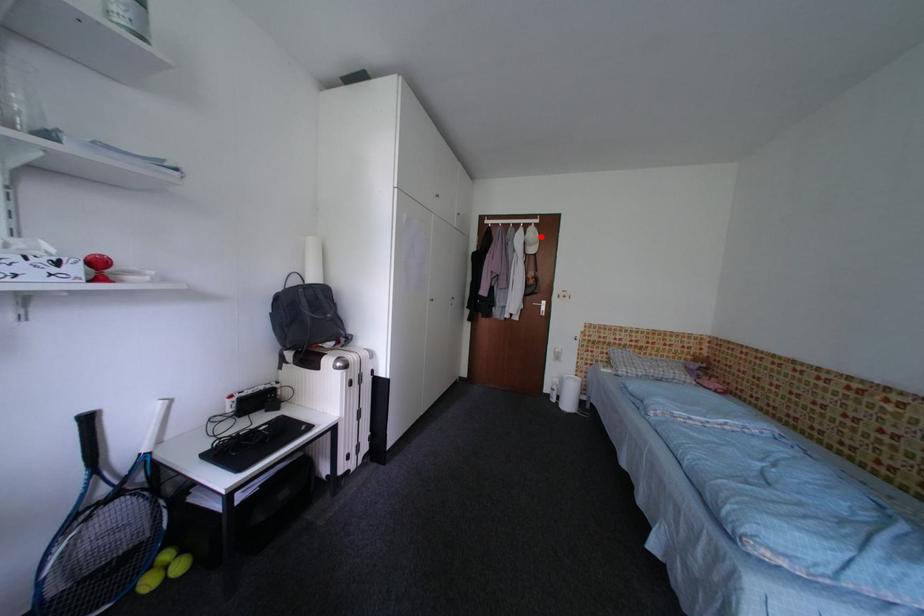
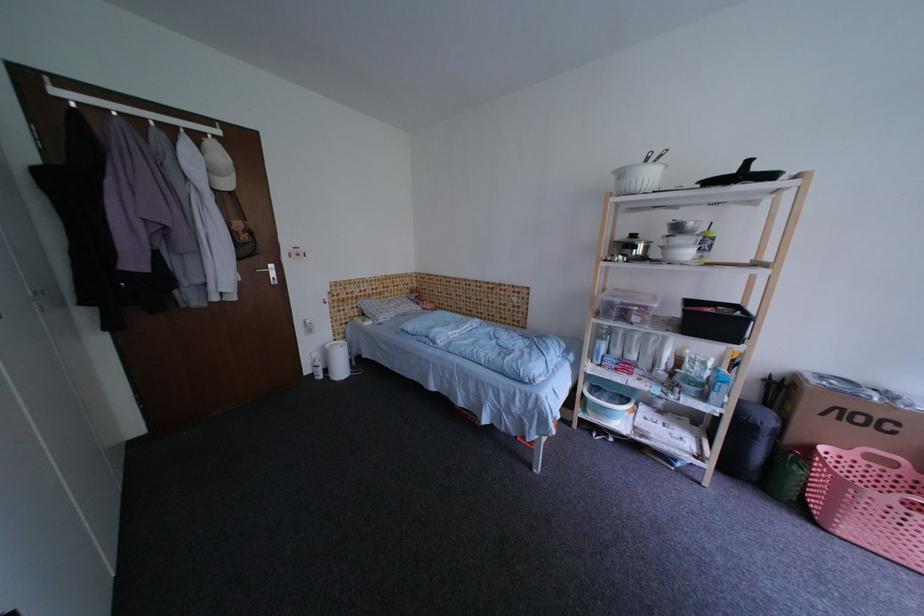
Locate, in the second image, the point that corresponds to the highlighted location in the first image.

(227, 158)